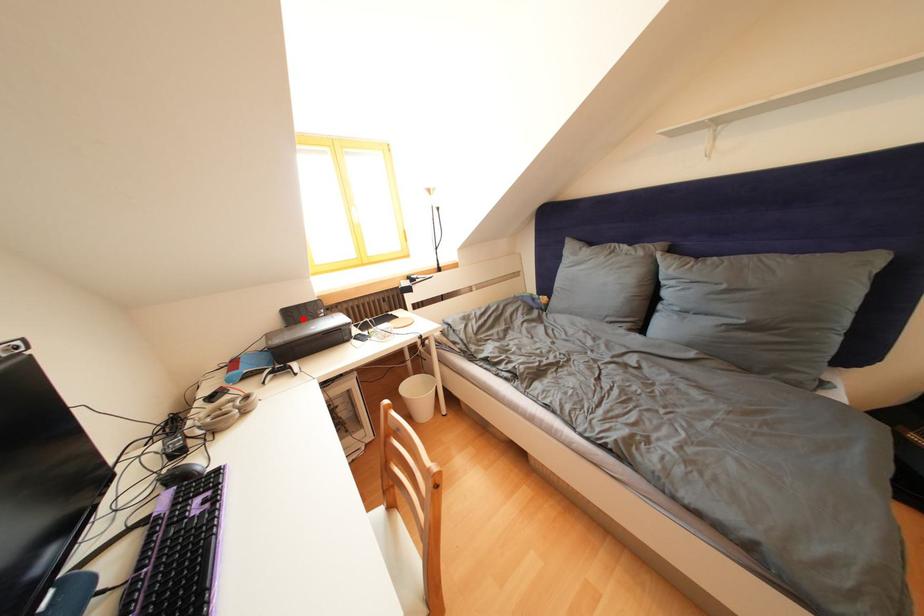
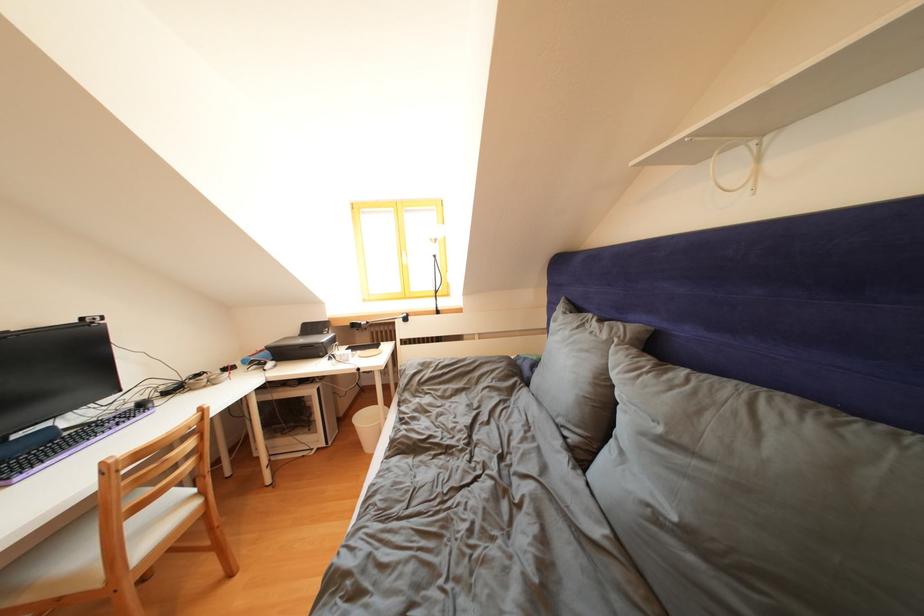
Question: I am providing you with two images of the same scene from different viewpoints. Image1 has a red point marked. In image2, the corresponding 3D location appears at what relative position? Reply with the corresponding letter.

Choices:
 (A) Closer
 (B) Farther

Answer: (B)